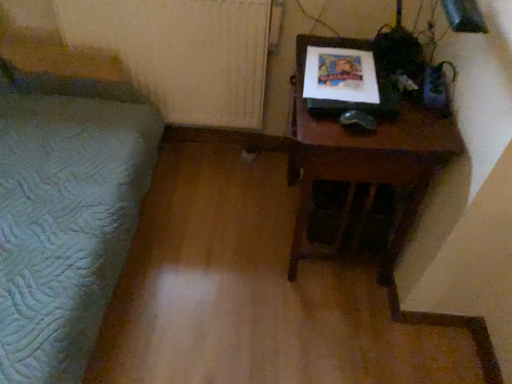
You are a GUI agent. You are given a task and a screenshot of the screen. Output one action in this format:
    pyautogui.click(x=<x>, y=<y>)
    Task: Click on the vacant area that lies between wooden table at right and green quilted bedspread at left
    
    Given the screenshot: What is the action you would take?
    pyautogui.click(x=225, y=260)